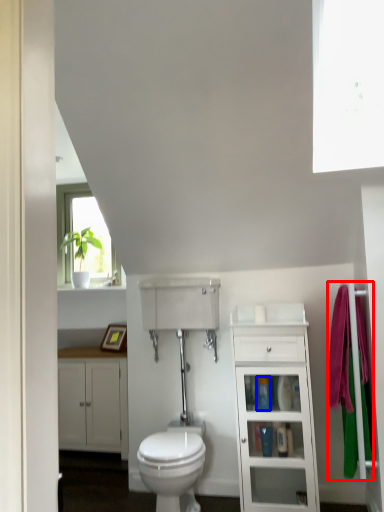
Question: Which point is further to the camera, bath towel (highlighted by a red box) or toiletry (highlighted by a blue box)?

Choices:
 (A) bath towel
 (B) toiletry

Answer: (B)